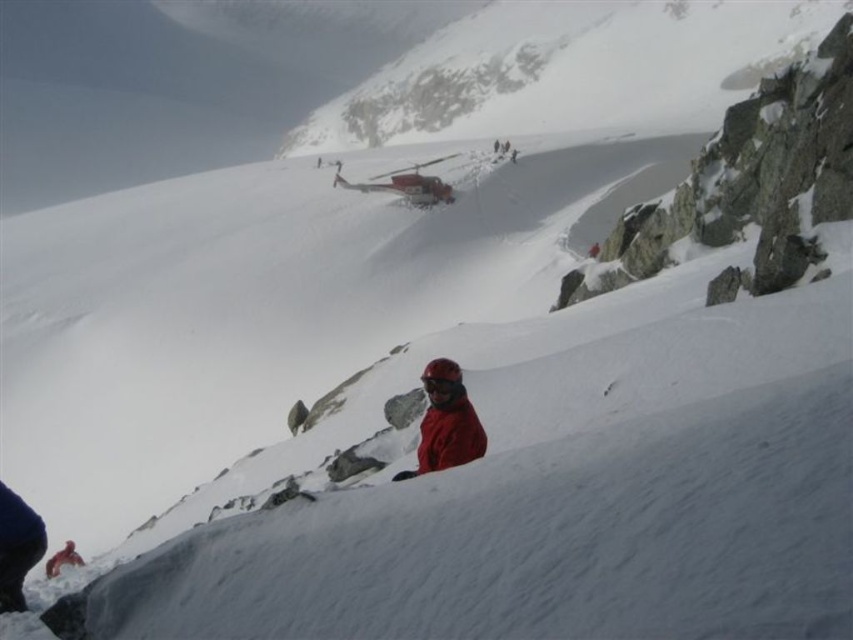
You are a photographer trying to capture both the matte red jacket at center and the red matte jacket at lower center in a single frame. Which jacket should you focus on first to ensure both are in the frame?

You should focus on the matte red jacket at center first because it is narrower than the red matte jacket at lower center, allowing more space for both in the frame.

You are a photographer standing at the camera position. You want to take a photo of the point at coordinates point (444, 413) and point (55, 561). Which point will appear closer to the camera in the photo?

Point (444, 413) is in front of point (55, 561), so it will appear closer to the camera in the photo.